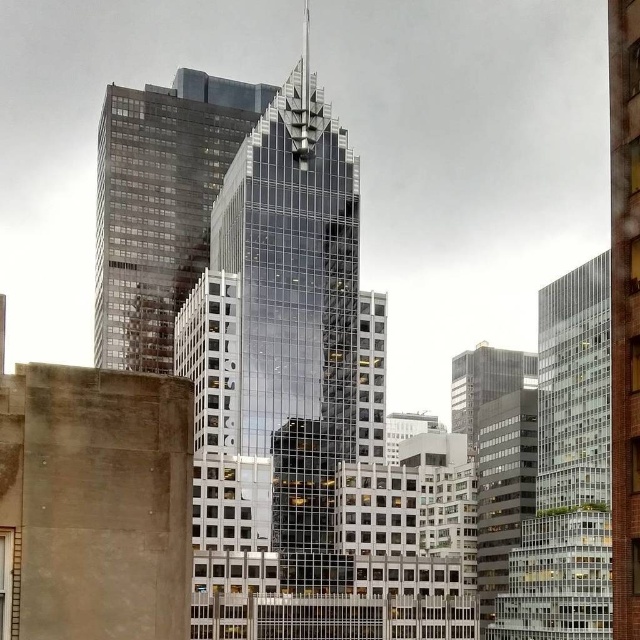
You are a drone operator tasked with flying a drone between two skyscrapers in the cityscape. The drone has a maximum flight distance of 25 meters. Can you safely fly the drone between the glassy reflective skyscraper at center and the glassy steel skyscraper at center without exceeding the distance limit?

The glassy reflective skyscraper at center is 24.35 meters away from the glassy steel skyscraper at center. Since the drone has a maximum flight distance of 25 meters, it can safely fly between them as the distance is within the limit.

Based on the photo, you are standing at the center of the city and see the point marked at coordinates point (x=276, y=358). What does this point indicate?

The point (x=276, y=358) marks the glassy reflective skyscraper at center.